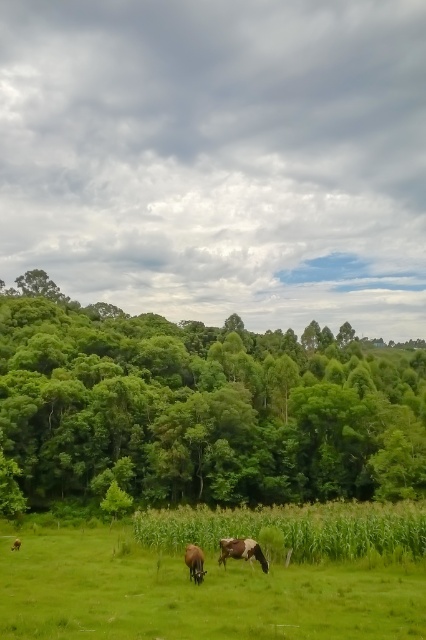
You are a farmer who wants to check the distance between the green leafy trees at left and the brown and white cow at center. According to the image, how far apart are they?

The green leafy trees at left and brown and white cow at center are 74.01 meters apart.

You are a farmer standing at the edge of the green grass pasture at lower center. You want to reach the brown glossy horse at center to feed it. Is the horse above or below you?

The green grass pasture at lower center is below the brown glossy horse at center, so the horse is above you.

You are a farmer who wants to move a fence post from the green grass pasture at lower center to the brown glossy horse at center. Which direction should you move it to place it correctly?

The green grass pasture at lower center is positioned on the left side of brown glossy horse at center, so you should move the fence post to the right to place it correctly.